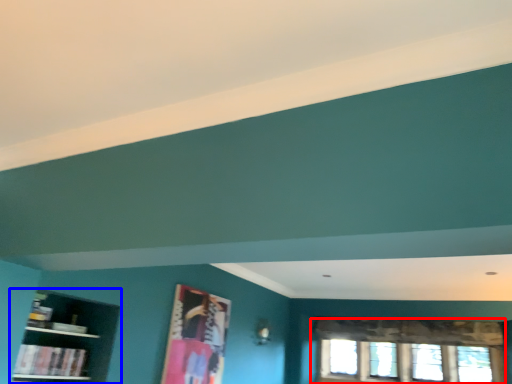
Question: Which point is further to the camera, window (highlighted by a red box) or shelf (highlighted by a blue box)?

Choices:
 (A) window
 (B) shelf

Answer: (A)